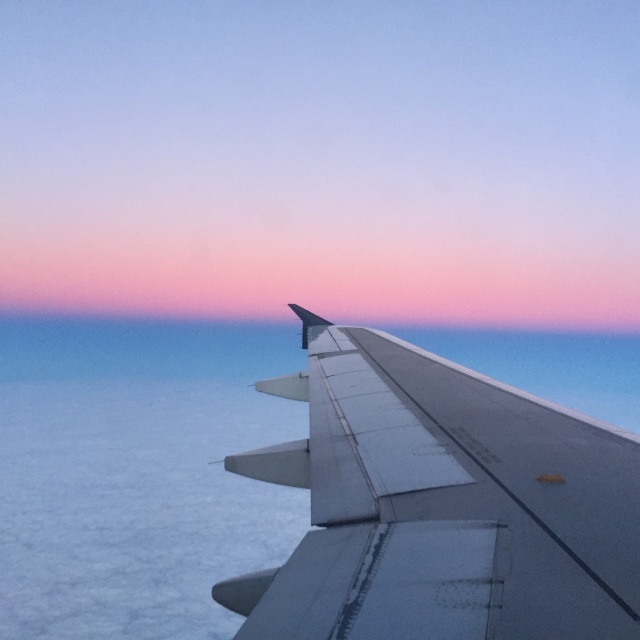
You are a flight attendant who needs to determine the relative size of the matte white wing at center and the metallic gray wing at right for a safety report. Based on the scene, which wing is taller?

The matte white wing at center is much taller than the metallic gray wing at right.

You are an airplane engineer analyzing the wing position in the image. The coordinates provided are in the normalized image coordinate system where the origin is at the top left corner. If the image width is 1920 pixels and height is 1080 pixels, what are the pixel coordinates of the matte white wing at center?

The pixel coordinates of the matte white wing at center can be calculated by multiplying the normalized coordinates by the image dimensions. The x coordinate is 0.250 multiplied by 1920 pixels, which equals 480 pixels. The y coordinate is 0.505 multiplied by 1080 pixels, which equals approximately 545 pixels. Therefore, the pixel coordinates are approximately (639,639).

You are a pilot preparing for takeoff and notice two wings in your view. The matte white wing at center and the metallic gray wing at right. Which wing is closer to the runway? Please explain your reasoning based on their positions.

The matte white wing at center is closer to the runway because it is positioned in the center of the view, while the metallic gray wing at right is further away. However, according to the description, both wings are 120.45 meters apart. Since the distance between them is fixed, their proximity to the runway cannot be determined solely by their positions in the image. Additional information about their orientation relative to the runway is needed to accurately determine which is closer.